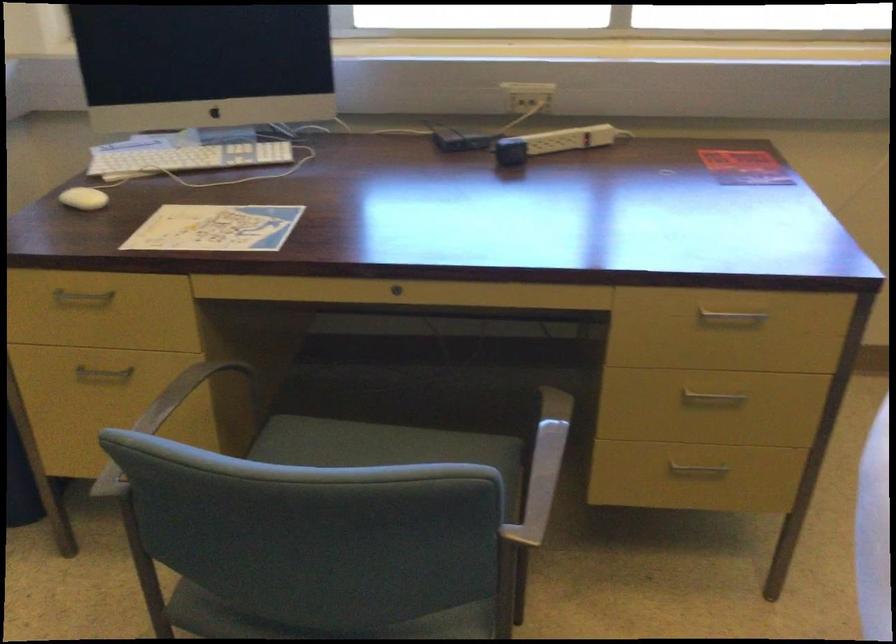
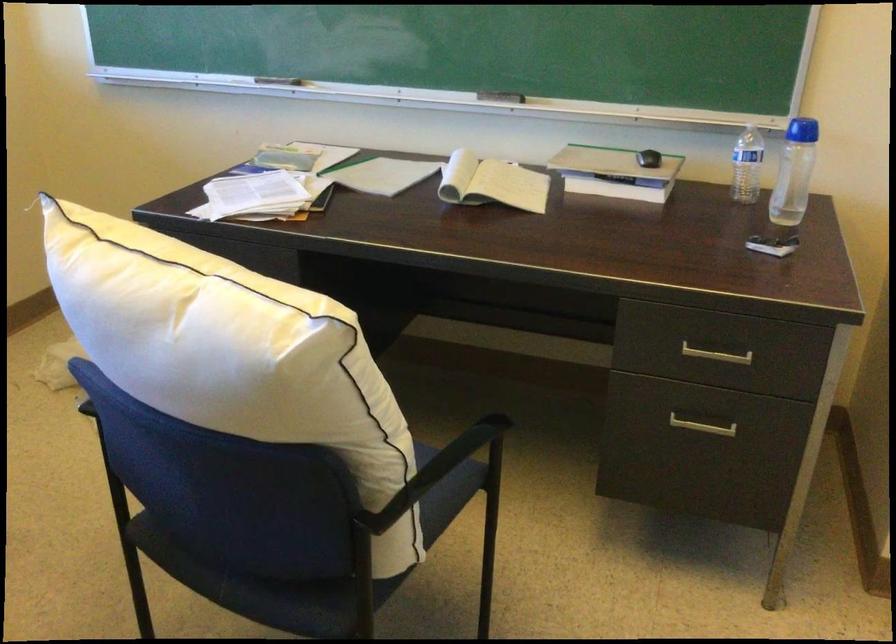
Question: The images are taken continuously from a first-person perspective. In which direction is your viewpoint rotating?

Choices:
 (A) Left
 (B) Right
 (C) Up
 (D) Down

Answer: (B)